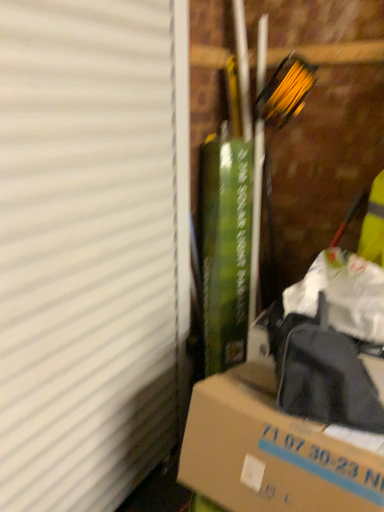
Find the location of a particular element. The width and height of the screenshot is (384, 512). brown cardboard box at lower right is located at coordinates (273, 452).

What do you see at coordinates (273, 452) in the screenshot? I see `brown cardboard box at lower right` at bounding box center [273, 452].

What do you see at coordinates (92, 247) in the screenshot? I see `white matte window screen at left` at bounding box center [92, 247].

What are the coordinates of `white matte window screen at left` in the screenshot? It's located at point(92,247).

Where is `brown cardboard box at lower right`? The height and width of the screenshot is (512, 384). brown cardboard box at lower right is located at coordinates (273, 452).

Is brown cardboard box at lower right to the right of white matte window screen at left from the viewer's perspective?

Yes.

Which object is closer to the camera taking this photo, brown cardboard box at lower right or white matte window screen at left?

white matte window screen at left is more forward.

Does point (293, 467) lie behind point (112, 49)?

No, it is not.

From the image's perspective, is brown cardboard box at lower right under white matte window screen at left?

Yes.

From a real-world perspective, which object rests below the other?

From a 3D spatial view, brown cardboard box at lower right is below.

Which object is thinner, brown cardboard box at lower right or white matte window screen at left?

Thinner between the two is white matte window screen at left.

Does brown cardboard box at lower right have a greater height compared to white matte window screen at left?

No.

Can you confirm if brown cardboard box at lower right is bigger than white matte window screen at left?

Incorrect, brown cardboard box at lower right is not larger than white matte window screen at left.

Is brown cardboard box at lower right surrounding white matte window screen at left?

No, white matte window screen at left is not inside brown cardboard box at lower right.

Is brown cardboard box at lower right not near white matte window screen at left?

No, there isn't a large distance between brown cardboard box at lower right and white matte window screen at left.

Consider the image. Could you tell me if brown cardboard box at lower right is turned towards white matte window screen at left?

No, brown cardboard box at lower right does not turn towards white matte window screen at left.

What's the angular difference between brown cardboard box at lower right and white matte window screen at left's facing directions?

The angular difference between brown cardboard box at lower right and white matte window screen at left is 90.3 degrees.

How much distance is there between brown cardboard box at lower right and white matte window screen at left?

The distance of brown cardboard box at lower right from white matte window screen at left is 64.18 centimeters.

Where is `window screen above the brown cardboard box at lower right (from a real-world perspective)`? window screen above the brown cardboard box at lower right (from a real-world perspective) is located at coordinates (92, 247).

Considering the positions of objects white matte window screen at left and brown cardboard box at lower right in the image provided, who is more to the left, white matte window screen at left or brown cardboard box at lower right?

white matte window screen at left.

Does white matte window screen at left lie behind brown cardboard box at lower right?

No, the depth of white matte window screen at left is less than that of brown cardboard box at lower right.

Which point is more forward, (186, 221) or (246, 467)?

The point (246, 467) is closer to the camera.

From the image's perspective, is white matte window screen at left located above brown cardboard box at lower right?

Yes.

From a real-world perspective, does white matte window screen at left sit lower than brown cardboard box at lower right?

Incorrect, from a real-world perspective, white matte window screen at left is higher than brown cardboard box at lower right.

Considering the relative sizes of white matte window screen at left and brown cardboard box at lower right in the image provided, is white matte window screen at left thinner than brown cardboard box at lower right?

Yes, white matte window screen at left is thinner than brown cardboard box at lower right.

Considering the sizes of white matte window screen at left and brown cardboard box at lower right in the image, is white matte window screen at left taller or shorter than brown cardboard box at lower right?

Considering their sizes, white matte window screen at left has more height than brown cardboard box at lower right.

Does white matte window screen at left have a smaller size compared to brown cardboard box at lower right?

Incorrect, white matte window screen at left is not smaller in size than brown cardboard box at lower right.

Is brown cardboard box at lower right completely or partially inside white matte window screen at left?

No, brown cardboard box at lower right is not a part of white matte window screen at left.

Is white matte window screen at left with brown cardboard box at lower right?

No, white matte window screen at left is not making contact with brown cardboard box at lower right.

Is white matte window screen at left oriented towards brown cardboard box at lower right?

Yes, white matte window screen at left faces towards brown cardboard box at lower right.

How many degrees apart are the facing directions of white matte window screen at left and brown cardboard box at lower right?

There is a 90.3-degree angle between the facing directions of white matte window screen at left and brown cardboard box at lower right.

Locate an element on the screen. The width and height of the screenshot is (384, 512). window screen above the brown cardboard box at lower right (from the image's perspective) is located at coordinates 92,247.

I want to click on box behind the white matte window screen at left, so click(x=273, y=452).

Find the location of a particular element. box that is under the white matte window screen at left (from a real-world perspective) is located at coordinates (273, 452).